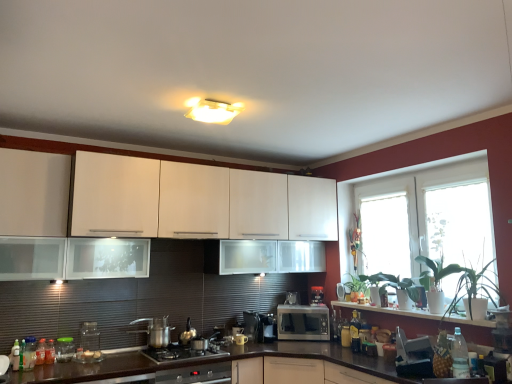
Identify the location of free point above transparent glass window at right, which appears as the second window screen when viewed from the left (from a real-world perspective). (458, 183).